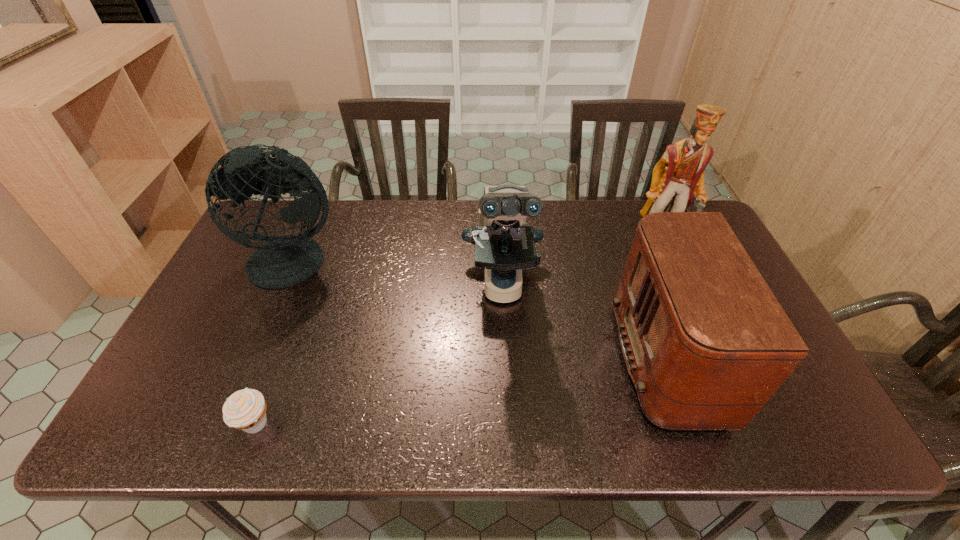
Where is `object positioned at the far left corner`? object positioned at the far left corner is located at coordinates (284, 261).

This screenshot has height=540, width=960. I want to click on object situated at the far right corner, so coord(678,177).

Locate an element on the screen. Image resolution: width=960 pixels, height=540 pixels. object at the near right corner is located at coordinates (706, 343).

In the image, there is a desktop. Where is `free space at the far edge`? The image size is (960, 540). free space at the far edge is located at coordinates (474, 219).

This screenshot has height=540, width=960. Identify the location of free space at the near edge of the desktop. (455, 409).

The width and height of the screenshot is (960, 540). What are the coordinates of `free space at the left edge of the desktop` in the screenshot? It's located at (211, 363).

You are a GUI agent. You are given a task and a screenshot of the screen. Output one action in this format:
    pyautogui.click(x=<x>, y=<y>)
    Task: Click on the free region at the far left corner
    Image resolution: width=960 pixels, height=540 pixels.
    Given the screenshot: What is the action you would take?
    pyautogui.click(x=281, y=226)

I want to click on vacant area that lies between the nutcracker and the muffin, so click(x=459, y=334).

Locate an element on the screen. The width and height of the screenshot is (960, 540). empty space that is in between the nutcracker and the shortest object is located at coordinates (459, 334).

Locate an element on the screen. The image size is (960, 540). vacant point located between the microscope and the shortest object is located at coordinates (379, 354).